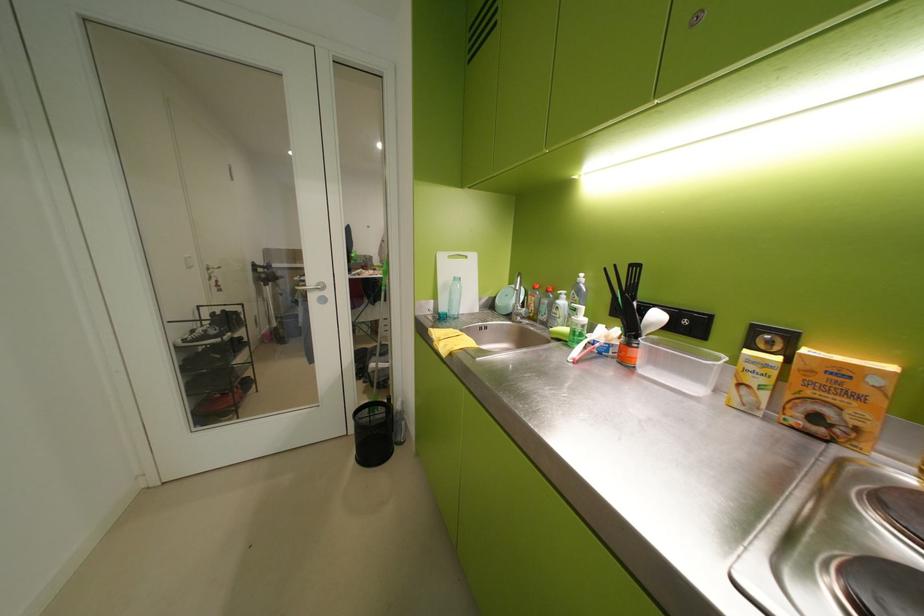
Which object does [372,432] point to?

It refers to a black trash can.